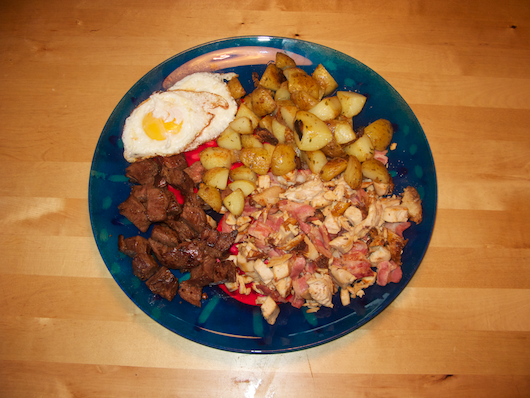
I want to click on blue plate, so click(246, 342).